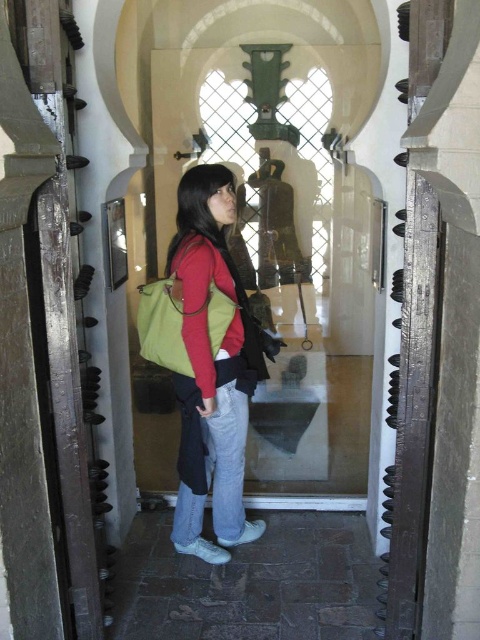
Is point (180, 394) in front of point (194, 266)?

No, it is not.

Is matte green bag at center behind green fabric bag at center?

Yes.

Which is behind, point (213, 234) or point (167, 358)?

Positioned behind is point (213, 234).

Image resolution: width=480 pixels, height=640 pixels. Find the location of `matte green bag at center`. matte green bag at center is located at coordinates (212, 369).